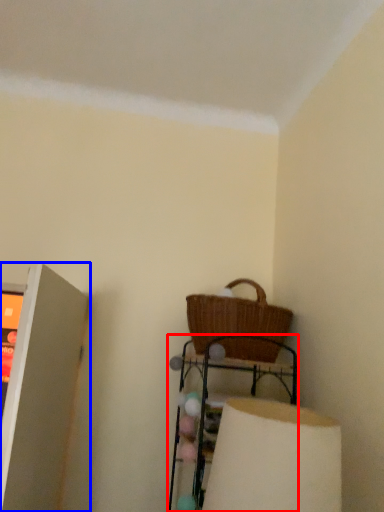
Question: Which of the following is the farthest to the observer, furniture (highlighted by a red box) or shelf (highlighted by a blue box)?

Choices:
 (A) furniture
 (B) shelf

Answer: (A)